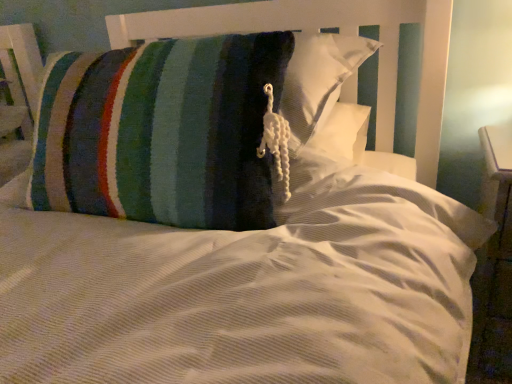
The image size is (512, 384). Describe the element at coordinates (494, 265) in the screenshot. I see `white glossy dresser at right` at that location.

The height and width of the screenshot is (384, 512). Find the location of `white glossy dresser at right`. white glossy dresser at right is located at coordinates (494, 265).

Where is `knitted striped pillow at center`? The height and width of the screenshot is (384, 512). knitted striped pillow at center is located at coordinates (185, 126).

What do you see at coordinates (185, 126) in the screenshot?
I see `knitted striped pillow at center` at bounding box center [185, 126].

Locate an element on the screen. This screenshot has width=512, height=384. white glossy dresser at right is located at coordinates (494, 265).

Does knitted striped pillow at center appear on the left side of white glossy dresser at right?

Yes.

Is knitted striped pillow at center in front of or behind white glossy dresser at right in the image?

knitted striped pillow at center is positioned closer to the viewer than white glossy dresser at right.

Is point (50, 66) closer or farther from the camera than point (478, 318)?

Point (50, 66) is positioned closer to the camera compared to point (478, 318).

From the image's perspective, is knitted striped pillow at center above white glossy dresser at right?

Yes, from the image's perspective, knitted striped pillow at center is above white glossy dresser at right.

From a real-world perspective, is knitted striped pillow at center located higher than white glossy dresser at right?

Indeed, from a real-world perspective, knitted striped pillow at center stands above white glossy dresser at right.

Can you confirm if knitted striped pillow at center is thinner than white glossy dresser at right?

Incorrect, the width of knitted striped pillow at center is not less than that of white glossy dresser at right.

Who is shorter, knitted striped pillow at center or white glossy dresser at right?

With less height is knitted striped pillow at center.

Can you confirm if knitted striped pillow at center is smaller than white glossy dresser at right?

Actually, knitted striped pillow at center might be larger than white glossy dresser at right.

Could white glossy dresser at right be considered to be inside knitted striped pillow at center?

Actually, white glossy dresser at right is outside knitted striped pillow at center.

Is knitted striped pillow at center placed right next to white glossy dresser at right?

No, knitted striped pillow at center is not touching white glossy dresser at right.

From the picture: Is knitted striped pillow at center oriented away from white glossy dresser at right?

knitted striped pillow at center does not have its back to white glossy dresser at right.

This screenshot has height=384, width=512. What are the coordinates of `pillow in front of the white glossy dresser at right` in the screenshot? It's located at (185, 126).

Visually, is white glossy dresser at right positioned to the left or to the right of knitted striped pillow at center?

In the image, white glossy dresser at right appears on the right side of knitted striped pillow at center.

Does white glossy dresser at right come in front of knitted striped pillow at center?

No, white glossy dresser at right is further to the viewer.

Does point (493, 153) lie behind point (257, 38)?

Yes, it is.

Looking at this image, from the image's perspective, between white glossy dresser at right and knitted striped pillow at center, which one is located above?

knitted striped pillow at center is shown above in the image.

From a real-world perspective, is white glossy dresser at right above or below knitted striped pillow at center?

In terms of real-world spatial position, white glossy dresser at right is below knitted striped pillow at center.

In terms of width, does white glossy dresser at right look wider or thinner when compared to knitted striped pillow at center?

In the image, white glossy dresser at right appears to be more narrow than knitted striped pillow at center.

Looking at this image, considering the relative sizes of white glossy dresser at right and knitted striped pillow at center in the image provided, is white glossy dresser at right shorter than knitted striped pillow at center?

Incorrect, the height of white glossy dresser at right does not fall short of that of knitted striped pillow at center.

Considering the sizes of objects white glossy dresser at right and knitted striped pillow at center in the image provided, who is bigger, white glossy dresser at right or knitted striped pillow at center?

knitted striped pillow at center.

Is white glossy dresser at right located outside knitted striped pillow at center?

Yes, white glossy dresser at right is not within knitted striped pillow at center.

Based on the photo, is white glossy dresser at right touching knitted striped pillow at center?

They are not placed beside each other.

Is knitted striped pillow at center at the back of white glossy dresser at right?

No, white glossy dresser at right is not facing away from knitted striped pillow at center.

How different are the orientations of white glossy dresser at right and knitted striped pillow at center in degrees?

white glossy dresser at right and knitted striped pillow at center are facing 92.8 degrees away from each other.

In the scene shown: Measure the distance between white glossy dresser at right and knitted striped pillow at center.

white glossy dresser at right is 60.30 centimeters away from knitted striped pillow at center.

The height and width of the screenshot is (384, 512). In order to click on pillow in front of the white glossy dresser at right in this screenshot , I will do `click(185, 126)`.

This screenshot has height=384, width=512. I want to click on pillow above the white glossy dresser at right (from the image's perspective), so click(x=185, y=126).

The image size is (512, 384). Find the location of `dresser on the right of the knitted striped pillow at center`. dresser on the right of the knitted striped pillow at center is located at coordinates (494, 265).